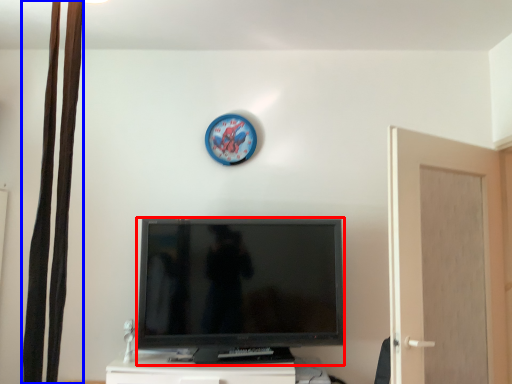
Question: Which object appears farthest to the camera in this image, television (highlighted by a red box) or curtain (highlighted by a blue box)?

Choices:
 (A) television
 (B) curtain

Answer: (A)